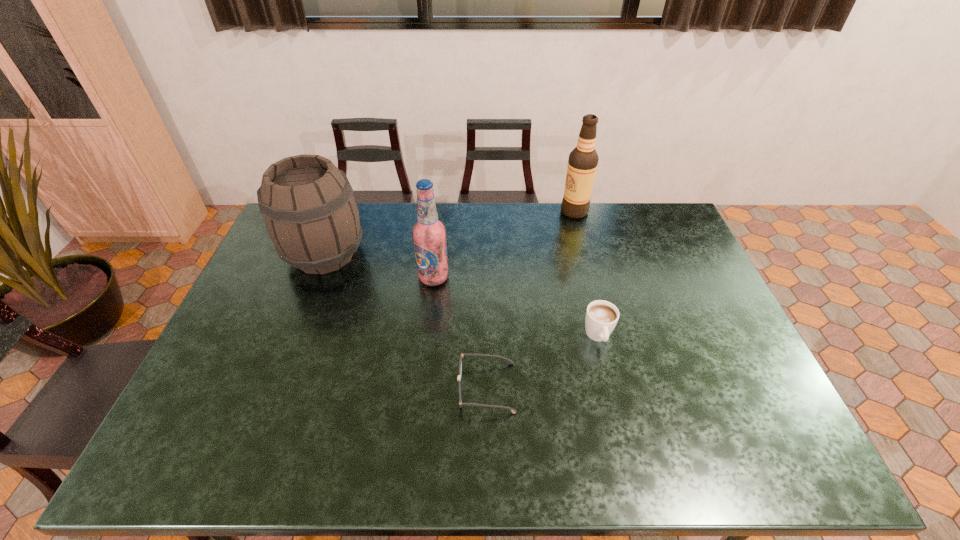
The image size is (960, 540). Find the location of `free region located on the label of the right alcohol`. free region located on the label of the right alcohol is located at coordinates (540, 211).

Identify the location of vacant point located 0.160m on the label of the right alcohol. The width and height of the screenshot is (960, 540). (519, 211).

At what (x,y) coordinates should I click in order to perform the action: click on blank space located on the left of the second object from left to right. Please return your answer as a coordinate pair (x, y). Looking at the image, I should click on (320, 278).

This screenshot has width=960, height=540. In order to click on blank space located 0.070m on the back of the leftmost object in this screenshot , I will do `click(339, 218)`.

At what (x,y) coordinates should I click in order to perform the action: click on vacant space located with the handle on the side of the cappuccino. Please return your answer as a coordinate pair (x, y). This screenshot has width=960, height=540. Looking at the image, I should click on (618, 420).

The image size is (960, 540). I want to click on free region located on the face of the third object from right to left, so click(427, 388).

This screenshot has width=960, height=540. I want to click on vacant space located on the face of the third object from right to left, so click(x=408, y=388).

Where is `free spot located on the face of the third object from right to left`? Image resolution: width=960 pixels, height=540 pixels. free spot located on the face of the third object from right to left is located at coordinates (353, 388).

You are a GUI agent. You are given a task and a screenshot of the screen. Output one action in this format:
    pyautogui.click(x=<x>, y=<y>)
    Task: Click on the alcohol that is at the far edge
    
    Given the screenshot: What is the action you would take?
    tap(582, 164)

Locate an element on the screen. wine bucket that is at the far edge is located at coordinates (311, 216).